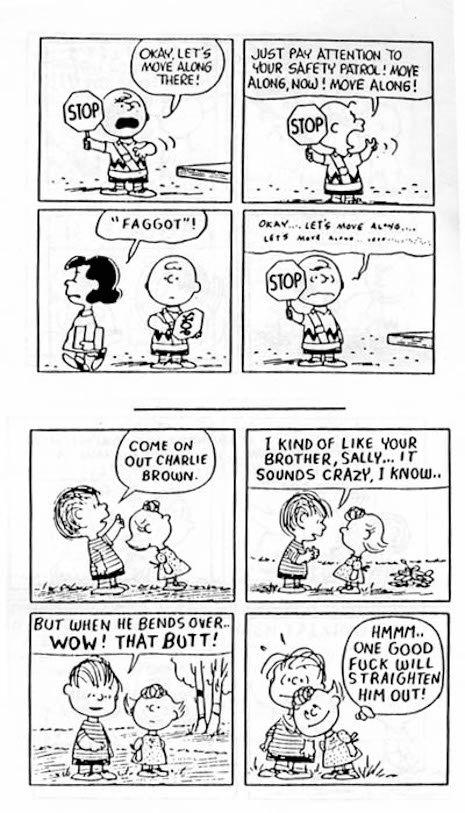
At what (x,y) coordinates should I click in order to perform the action: click on top left corner of panel. Please return your answer as a coordinate pair (x, y). The width and height of the screenshot is (465, 813). Looking at the image, I should click on (41, 36), (244, 37), (39, 209), (244, 211), (34, 429), (249, 431), (32, 611), (247, 615).